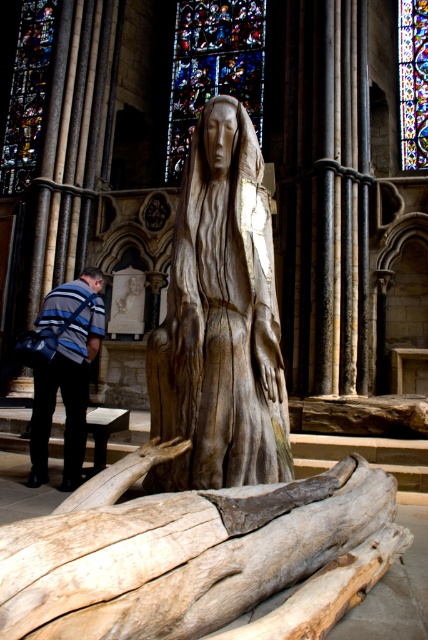
Question: Which of the following is the farthest from the observer?

Choices:
 (A) (199, 512)
 (B) (228, 58)
 (C) (419, 131)

Answer: (B)

Question: Can you confirm if wooden statue at center is smaller than stained glass at upper left?

Choices:
 (A) no
 (B) yes

Answer: (B)

Question: Which point appears closest to the camera in this image?

Choices:
 (A) (422, 97)
 (B) (165, 179)
 (C) (65, 436)
 (D) (180, 211)

Answer: (D)

Question: Can you confirm if light brown wood log at lower center is positioned above stained glass at upper left?

Choices:
 (A) no
 (B) yes

Answer: (A)

Question: Which point is closer to the camera?

Choices:
 (A) wooden statue at center
 (B) stained glass window at upper center
 (C) stained glass at upper center
 (D) striped fabric backpack at lower left

Answer: (A)

Question: Does light brown wood log at lower center have a greater width compared to wooden statue at center?

Choices:
 (A) no
 (B) yes

Answer: (B)